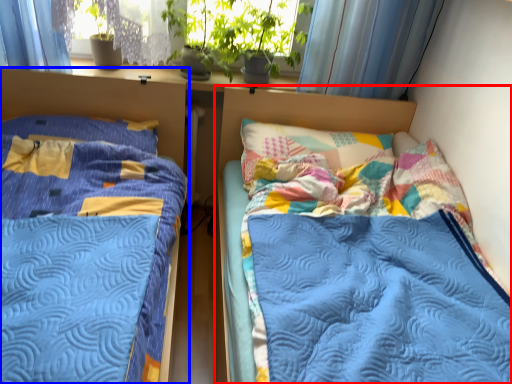
Question: Which object is further to the camera taking this photo, bed (highlighted by a red box) or bed (highlighted by a blue box)?

Choices:
 (A) bed
 (B) bed

Answer: (A)